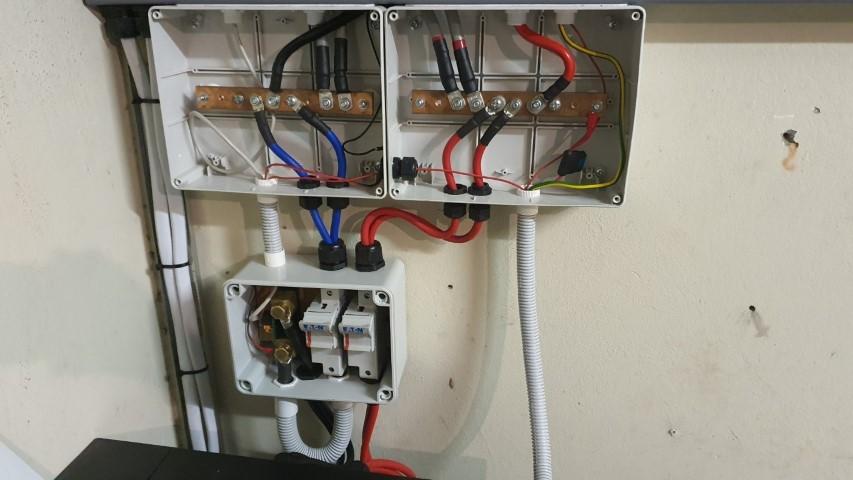
Where is `wall`? Image resolution: width=853 pixels, height=480 pixels. wall is located at coordinates (607, 298).